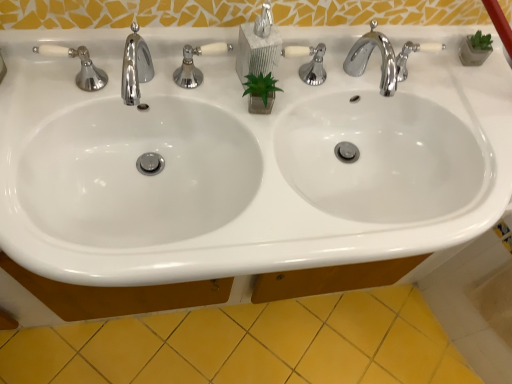
Identify the location of empty space that is ontop of yellow ceramic tile at lower center. This screenshot has height=384, width=512. click(x=276, y=345).